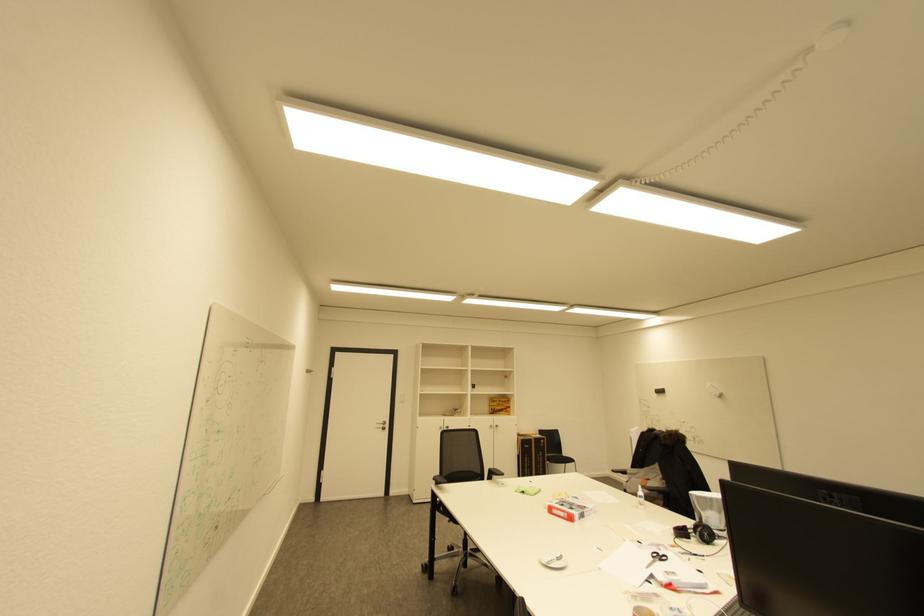
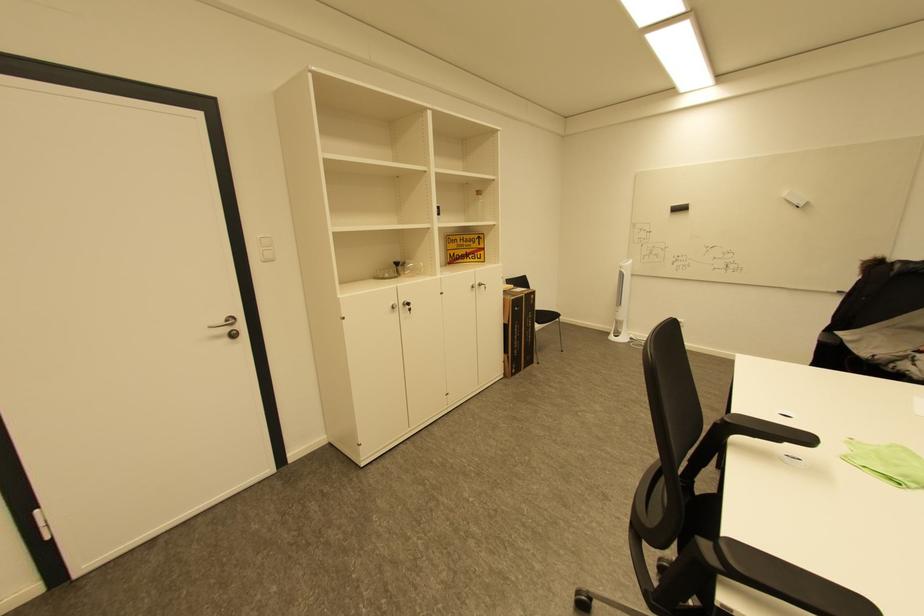
Locate, in the second image, the point that corresponds to point 460,410 in the first image.

(403, 264)